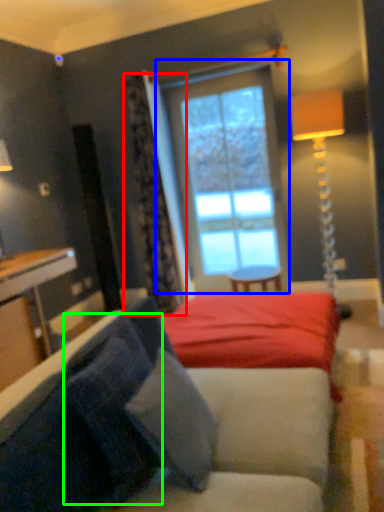
Question: Considering the real-world distances, which object is farthest from curtain (highlighted by a red box)? window (highlighted by a blue box) or pillow (highlighted by a green box)?

Choices:
 (A) window
 (B) pillow

Answer: (B)